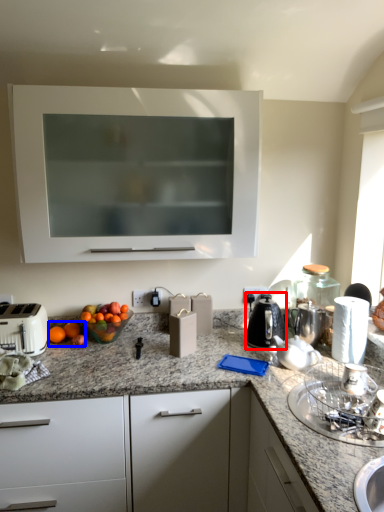
Question: Which object appears closest to the camera in this image, kitchen appliance (highlighted by a red box) or citrus fruit (highlighted by a blue box)?

Choices:
 (A) kitchen appliance
 (B) citrus fruit

Answer: (A)